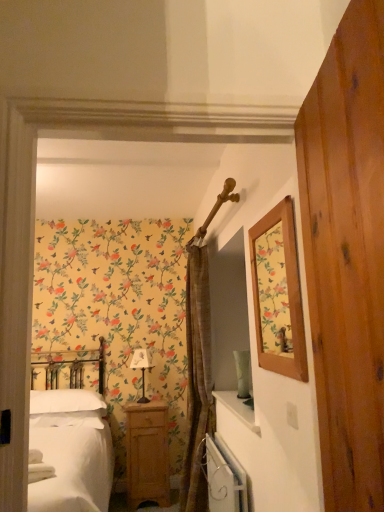
Where is `white soft pillow at lower left`? white soft pillow at lower left is located at coordinates (65, 401).

What is the approximate height of brown textured curtain at center?

brown textured curtain at center is 6.93 feet tall.

Where is `white fabric-covered lampshade at center`? Image resolution: width=384 pixels, height=512 pixels. white fabric-covered lampshade at center is located at coordinates (141, 368).

What is the approximate height of wooden barn door at right?

1.00 meters.

Measure the distance between light wood/texture nightstand at lower center and camera.

The distance of light wood/texture nightstand at lower center from camera is 10.95 feet.

Locate an element on the screen. The height and width of the screenshot is (512, 384). white soft pillow at lower left is located at coordinates (65, 401).

From a real-world perspective, which object rests below the other?

white fabric-covered lampshade at center, from a real-world perspective.

Looking at their sizes, would you say wooden picture frame at upper right is wider or thinner than white fabric-covered lampshade at center?

wooden picture frame at upper right is thinner than white fabric-covered lampshade at center.

Is wooden picture frame at upper right further to the viewer compared to white fabric-covered lampshade at center?

No, wooden picture frame at upper right is in front of white fabric-covered lampshade at center.

Where is `picture frame on the right side of white fabric-covered lampshade at center`? picture frame on the right side of white fabric-covered lampshade at center is located at coordinates (278, 293).

Does light wood/texture nightstand at lower center turn towards wooden picture frame at upper right?

Yes, light wood/texture nightstand at lower center faces towards wooden picture frame at upper right.

Is light wood/texture nightstand at lower center taller than wooden picture frame at upper right?

Correct, light wood/texture nightstand at lower center is much taller as wooden picture frame at upper right.

Is light wood/texture nightstand at lower center beside wooden picture frame at upper right?

No, light wood/texture nightstand at lower center is not beside wooden picture frame at upper right.

Looking at their sizes, would you say light wood/texture nightstand at lower center is wider or thinner than wooden picture frame at upper right?

Clearly, light wood/texture nightstand at lower center has more width compared to wooden picture frame at upper right.

Is brown textured curtain at center wider or thinner than wooden picture frame at upper right?

brown textured curtain at center is wider than wooden picture frame at upper right.

Who is more distant, brown textured curtain at center or wooden picture frame at upper right?

brown textured curtain at center is more distant.

Is brown textured curtain at center taller than wooden picture frame at upper right?

Indeed, brown textured curtain at center has a greater height compared to wooden picture frame at upper right.

From the image's perspective, is wooden barn door at right below white soft pillow at lower left?

No.

Are wooden barn door at right and white soft pillow at lower left making contact?

No, wooden barn door at right is not next to white soft pillow at lower left.

Relative to white soft pillow at lower left, is wooden barn door at right in front or behind?

Clearly, wooden barn door at right is in front of white soft pillow at lower left.

This screenshot has height=512, width=384. In order to click on pillow that appears behind the wooden barn door at right in this screenshot , I will do `click(65, 401)`.

From the picture: Would you consider white soft pillow at lower left to be distant from white fabric-covered lampshade at center?

white soft pillow at lower left is near white fabric-covered lampshade at center, not far away.

In terms of size, does white soft pillow at lower left appear bigger or smaller than white fabric-covered lampshade at center?

Considering their sizes, white soft pillow at lower left takes up more space than white fabric-covered lampshade at center.

Does point (66, 400) come farther from viewer compared to point (150, 361)?

No, it is not.

From the image's perspective, between light wood/texture nightstand at lower center and white metallic radiator at lower center, who is located below?

light wood/texture nightstand at lower center appears lower in the image.

From a real-world perspective, does light wood/texture nightstand at lower center stand above white metallic radiator at lower center?

No.

Considering the positions of objects light wood/texture nightstand at lower center and white metallic radiator at lower center in the image provided, who is behind, light wood/texture nightstand at lower center or white metallic radiator at lower center?

light wood/texture nightstand at lower center is further away from the camera.

Between light wood/texture nightstand at lower center and white metallic radiator at lower center, which one appears on the right side from the viewer's perspective?

Positioned to the right is white metallic radiator at lower center.

How different are the orientations of white metallic radiator at lower center and light wood/texture nightstand at lower center in degrees?

The facing directions of white metallic radiator at lower center and light wood/texture nightstand at lower center are 90.6 degrees apart.

From the image's perspective, who appears lower, white metallic radiator at lower center or light wood/texture nightstand at lower center?

light wood/texture nightstand at lower center appears lower in the image.

Measure the distance from white metallic radiator at lower center to light wood/texture nightstand at lower center.

white metallic radiator at lower center is 38.14 inches from light wood/texture nightstand at lower center.

Which is in front, point (225, 466) or point (149, 467)?

Point (225, 466)

Where is `table lamp that appears behind the wooden picture frame at upper right`? table lamp that appears behind the wooden picture frame at upper right is located at coordinates (141, 368).

Find the location of a particular element. nightstand below the wooden picture frame at upper right (from a real-world perspective) is located at coordinates (147, 453).

Looking at the image, which one is located further to white matte bed at left, white metallic radiator at lower center or brown textured curtain at center?

brown textured curtain at center lies further to white matte bed at left than the other object.

Considering their positions, is white metallic radiator at lower center positioned further to brown textured curtain at center than white fabric-covered lampshade at center?

white fabric-covered lampshade at center is positioned further to the anchor brown textured curtain at center.

From the image, which object appears to be nearer to brown textured curtain at center, white fabric-covered lampshade at center or wooden picture frame at upper right?

white fabric-covered lampshade at center.

When comparing their distances from white matte bed at left, does brown textured curtain at center or white soft pillow at lower left seem closer?

Based on the image, white soft pillow at lower left appears to be nearer to white matte bed at left.

When comparing their distances from brown textured curtain at center, does white fabric-covered lampshade at center or white metallic radiator at lower center seem closer?

white metallic radiator at lower center is positioned closer to the anchor brown textured curtain at center.

Which object lies nearer to the anchor point brown textured curtain at center, wooden barn door at right or light wood/texture nightstand at lower center?

The object closer to brown textured curtain at center is light wood/texture nightstand at lower center.

From the image, which object appears to be farther from white fabric-covered lampshade at center, white soft pillow at lower left or brown textured curtain at center?

Based on the image, brown textured curtain at center appears to be further to white fabric-covered lampshade at center.

Based on their spatial positions, is wooden picture frame at upper right or light wood/texture nightstand at lower center further from white fabric-covered lampshade at center?

Among the two, wooden picture frame at upper right is located further to white fabric-covered lampshade at center.

Locate an element on the screen. This screenshot has height=512, width=384. curtain located between wooden barn door at right and white soft pillow at lower left in the depth direction is located at coordinates (197, 379).

Image resolution: width=384 pixels, height=512 pixels. What are the coordinates of `curtain located between white matte bed at left and white soft pillow at lower left in the depth direction` in the screenshot? It's located at (197, 379).

The height and width of the screenshot is (512, 384). What are the coordinates of `radiator located between white matte bed at left and light wood/texture nightstand at lower center in the depth direction` in the screenshot? It's located at (224, 477).

Find the location of a particular element. bed located between wooden picture frame at upper right and light wood/texture nightstand at lower center in the depth direction is located at coordinates (71, 451).